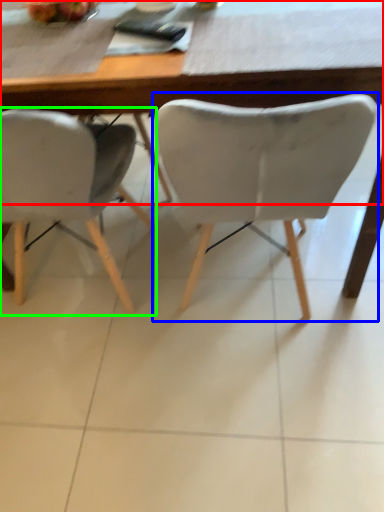
Question: Which object is the farthest from table (highlighted by a red box)? Choose among these: chair (highlighted by a blue box) or chair (highlighted by a green box).

Choices:
 (A) chair
 (B) chair

Answer: (B)